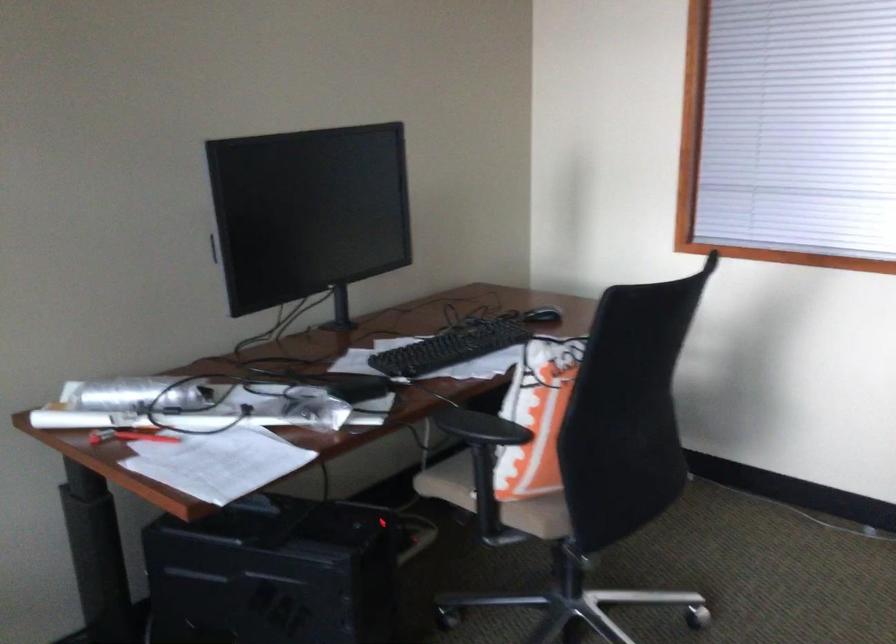
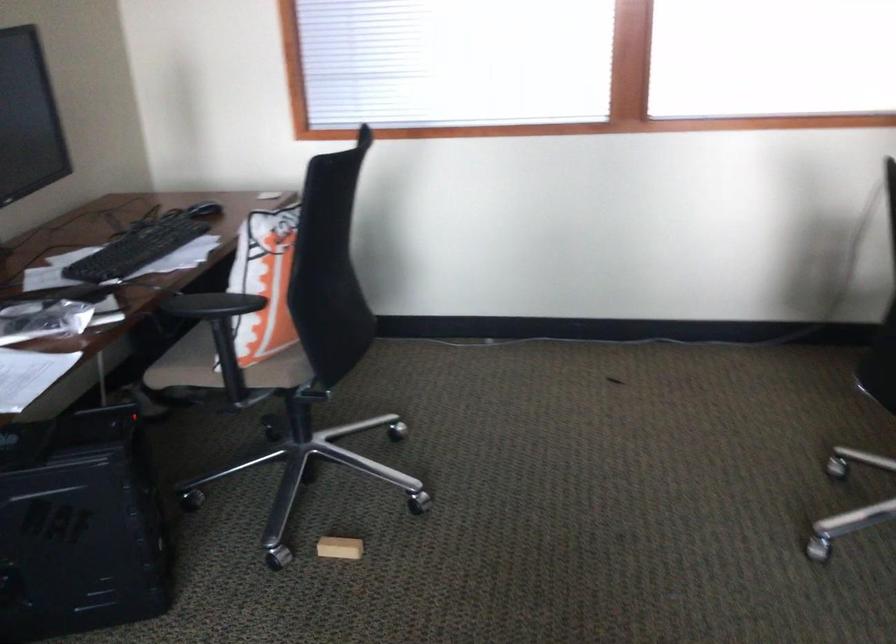
Question: The first image is from the beginning of the video and the second image is from the end. How did the camera likely rotate when shooting the video?

Choices:
 (A) Left
 (B) Right
 (C) Up
 (D) Down

Answer: (B)